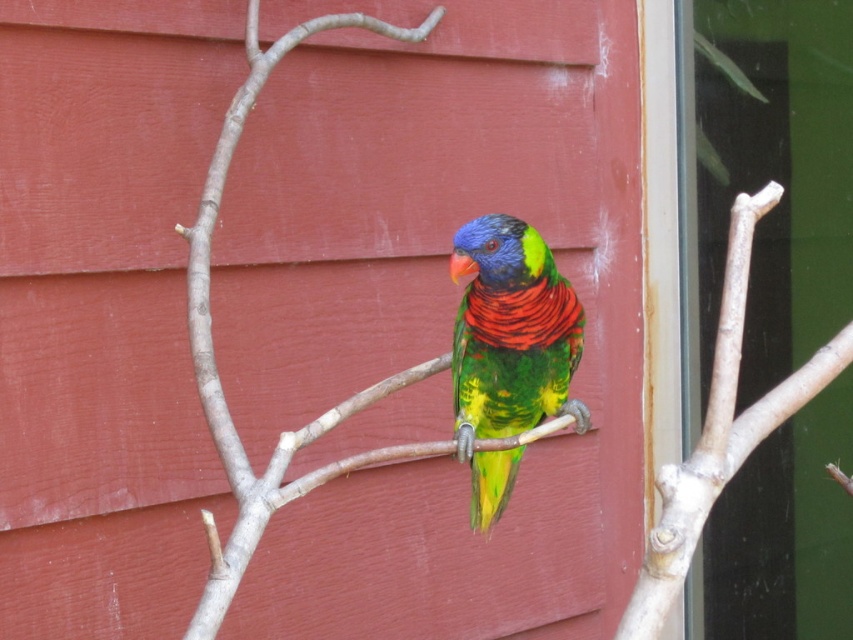
Question: Among these objects, which one is farthest from the camera?

Choices:
 (A) transparent glass at center
 (B) smooth wood branch at center

Answer: (A)

Question: Is transparent glass at center behind multicolored feathered parrot at center?

Choices:
 (A) yes
 (B) no

Answer: (A)

Question: Which object appears farthest from the camera in this image?

Choices:
 (A) transparent glass at center
 (B) multicolored feathered parrot at center

Answer: (A)

Question: Observing the image, what is the correct spatial positioning of transparent glass at center in reference to multicolored feathered parrot at center?

Choices:
 (A) right
 (B) left

Answer: (A)

Question: Which point is farther from the camera taking this photo?

Choices:
 (A) (498, 493)
 (B) (807, 333)
 (C) (201, 244)

Answer: (B)

Question: Does transparent glass at center have a greater width compared to multicolored feathered parrot at center?

Choices:
 (A) yes
 (B) no

Answer: (A)